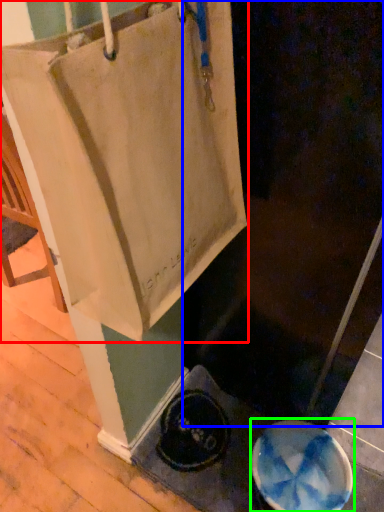
Question: Which is nearer to the tote bag (highlighted by a red box)? screen door (highlighted by a blue box) or manhole cover (highlighted by a green box).

Choices:
 (A) screen door
 (B) manhole cover

Answer: (A)